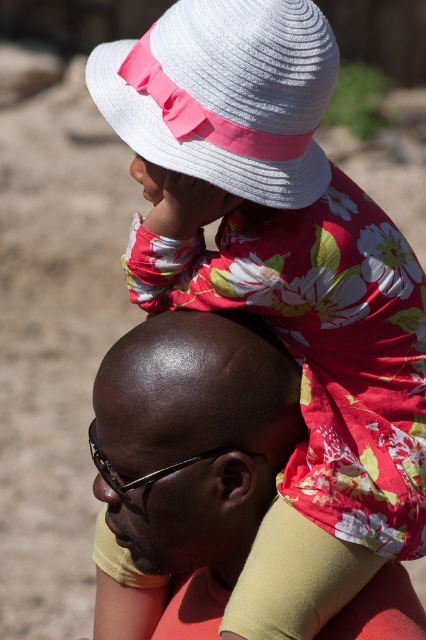
Who is higher up, shiny bald head at center or white woven hat at upper center?

white woven hat at upper center is higher up.

Is shiny bald head at center thinner than white woven hat at upper center?

Yes, shiny bald head at center is thinner than white woven hat at upper center.

Describe the element at coordinates (195, 435) in the screenshot. I see `shiny bald head at center` at that location.

Find the location of a particular element. shiny bald head at center is located at coordinates (195, 435).